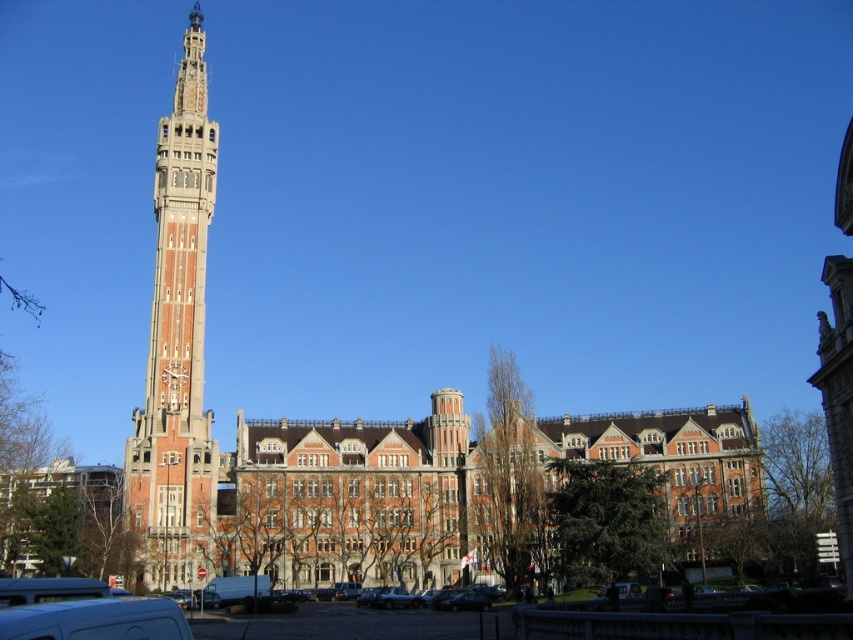
Question: Which object appears closest to the camera in this image?

Choices:
 (A) white matte van at lower left
 (B) red brick clock tower at left

Answer: (A)

Question: Is the position of red brick clock tower at left more distant than that of white matte van at lower left?

Choices:
 (A) no
 (B) yes

Answer: (B)

Question: Which point appears farthest from the camera in this image?

Choices:
 (A) (173, 376)
 (B) (149, 616)

Answer: (A)

Question: Where is red brick clock tower at left located in relation to white matte van at lower left in the image?

Choices:
 (A) left
 (B) right

Answer: (A)

Question: Does red brick clock tower at left appear over white matte van at lower left?

Choices:
 (A) yes
 (B) no

Answer: (A)